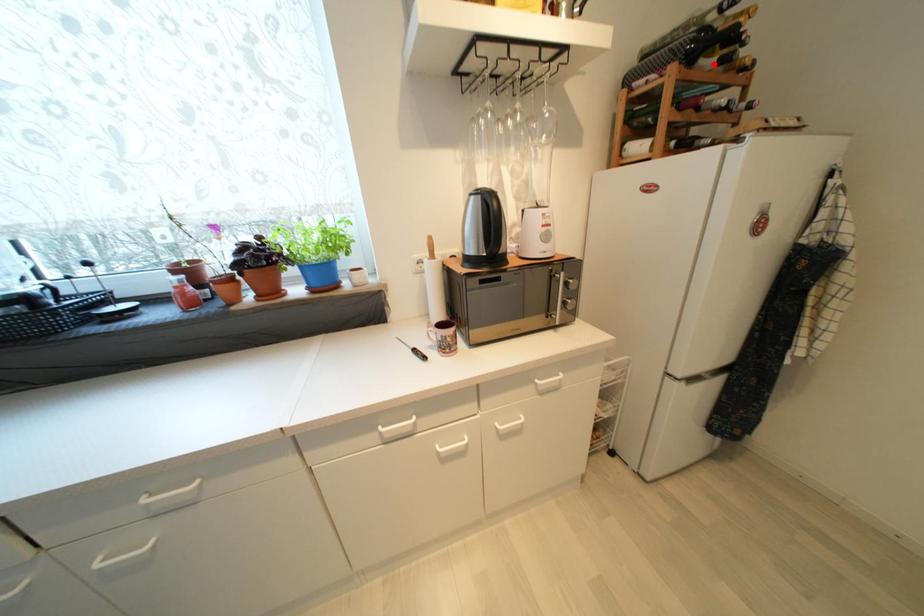
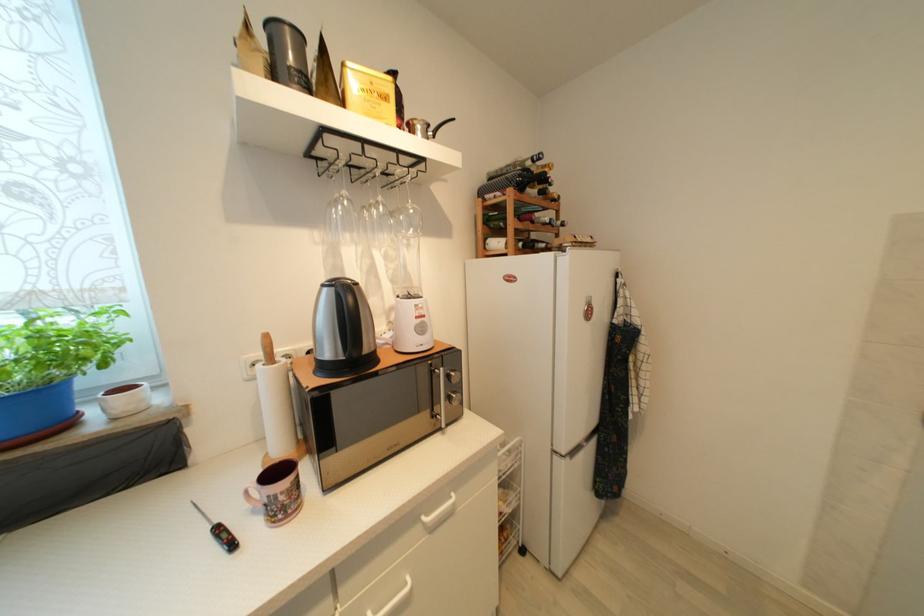
Question: A red point is marked in image1. In image2, is the corresponding 3D point closer to the camera or farther? Reply with the corresponding letter.

Choices:
 (A) The corresponding 3D point is closer.
 (B) The corresponding 3D point is farther.

Answer: (A)